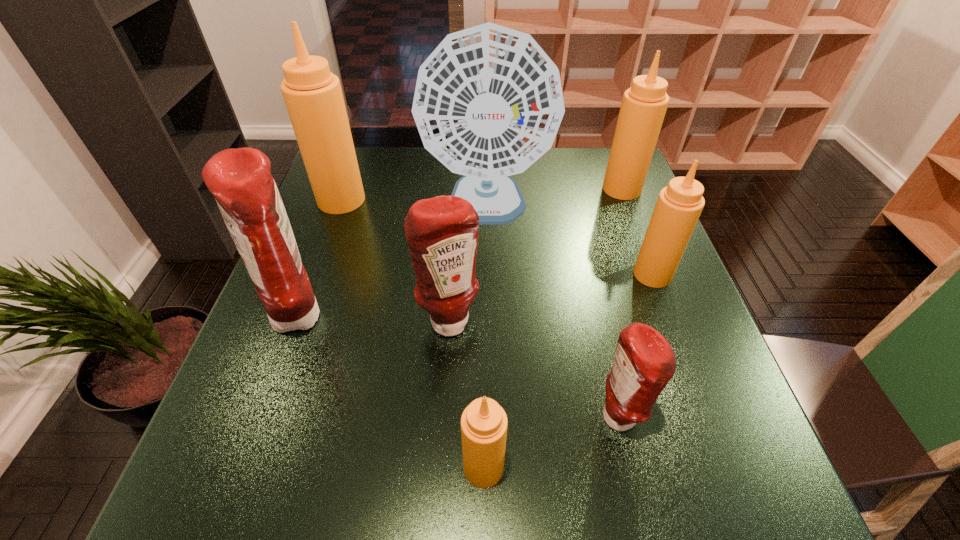
Select which condiment is the second closest to the second nearest object. Please provide its 2D coordinates. Your answer should be formatted as a tuple, i.e. [(x, y)], where the tuple contains the x and y coordinates of a point satisfying the conditions above.

[(442, 232)]

At what (x,y) coordinates should I click in order to perform the action: click on condiment that is the fifth closest to the nearest red condiment. Please return your answer as a coordinate pair (x, y). Looking at the image, I should click on (644, 104).

This screenshot has width=960, height=540. I want to click on the closest tan condiment relative to the fan, so click(644, 104).

You are a GUI agent. You are given a task and a screenshot of the screen. Output one action in this format:
    pyautogui.click(x=<x>, y=<y>)
    Task: Click on the tan condiment that stands as the third closest to the nearest object
    This screenshot has width=960, height=540.
    Given the screenshot: What is the action you would take?
    pyautogui.click(x=644, y=104)

Select which red condiment appears as the second closest to the tallest condiment. Please provide its 2D coordinates. Your answer should be formatted as a tuple, i.e. [(x, y)], where the tuple contains the x and y coordinates of a point satisfying the conditions above.

[(442, 232)]

The height and width of the screenshot is (540, 960). What are the coordinates of `red condiment that is the second closest to the tallest condiment` in the screenshot? It's located at (442, 232).

The height and width of the screenshot is (540, 960). In order to click on free space in the image that satisfies the following two spatial constraints: 1. on the back side of the second biggest tan condiment; 2. on the right side of the second nearest tan condiment in this screenshot , I will do `click(620, 189)`.